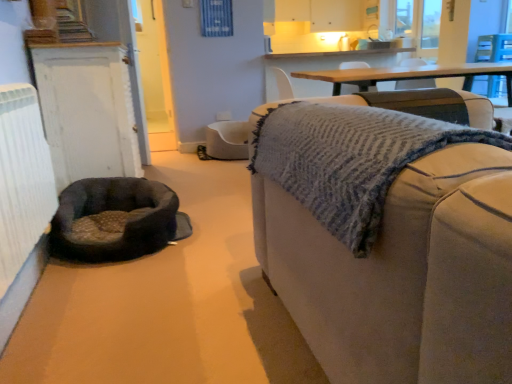
Question: Would you say soft gray fabric dog bed at lower left is outside white painted wood door at left?

Choices:
 (A) yes
 (B) no

Answer: (A)

Question: Is soft gray fabric dog bed at lower left next to white painted wood door at left and touching it?

Choices:
 (A) yes
 (B) no

Answer: (B)

Question: Can you confirm if soft gray fabric dog bed at lower left is wider than white painted wood door at left?

Choices:
 (A) no
 (B) yes

Answer: (B)

Question: Can you confirm if soft gray fabric dog bed at lower left is thinner than white painted wood door at left?

Choices:
 (A) no
 (B) yes

Answer: (A)

Question: Could you tell me if soft gray fabric dog bed at lower left is facing white painted wood door at left?

Choices:
 (A) yes
 (B) no

Answer: (B)

Question: Is white painted wood door at left a part of soft gray fabric dog bed at lower left?

Choices:
 (A) no
 (B) yes

Answer: (A)

Question: Is soft gray fabric dog bed at lower left far away from white textured radiator at left?

Choices:
 (A) no
 (B) yes

Answer: (A)

Question: From the image's perspective, is soft gray fabric dog bed at lower left beneath white textured radiator at left?

Choices:
 (A) yes
 (B) no

Answer: (A)

Question: Does soft gray fabric dog bed at lower left have a greater height compared to white textured radiator at left?

Choices:
 (A) yes
 (B) no

Answer: (B)

Question: Is soft gray fabric dog bed at lower left smaller than white textured radiator at left?

Choices:
 (A) yes
 (B) no

Answer: (A)

Question: From the image's perspective, is soft gray fabric dog bed at lower left on white textured radiator at left?

Choices:
 (A) no
 (B) yes

Answer: (A)

Question: Is soft gray fabric dog bed at lower left to the left of white textured radiator at left from the viewer's perspective?

Choices:
 (A) yes
 (B) no

Answer: (B)

Question: Is beige fabric couch at right closer to the viewer compared to white painted wood door at left?

Choices:
 (A) no
 (B) yes

Answer: (B)